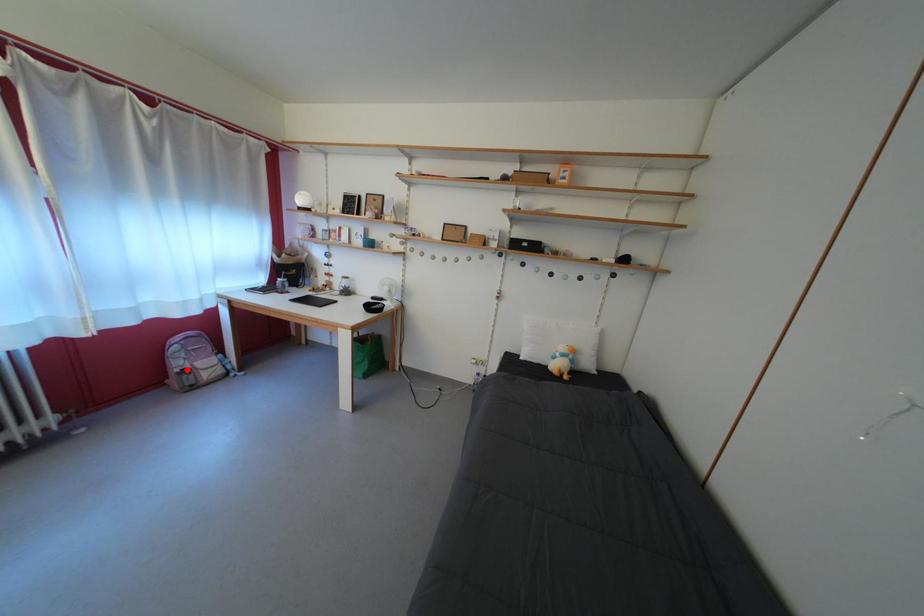
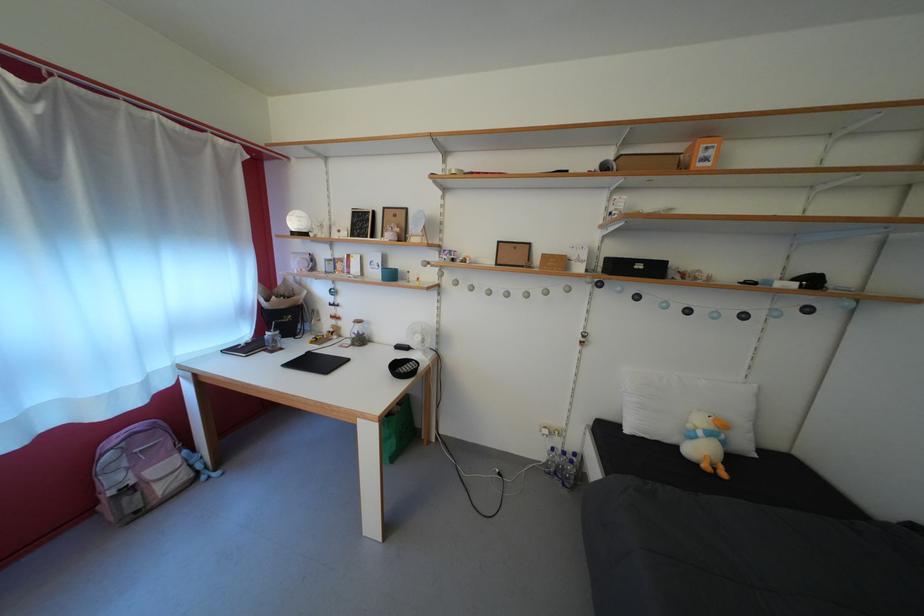
Question: I am providing you with two images of the same scene from different viewpoints. Image1 has a red point marked. In image2, the corresponding 3D location appears at what relative position? Reply with the corresponding letter.

Choices:
 (A) Closer
 (B) Farther

Answer: (B)